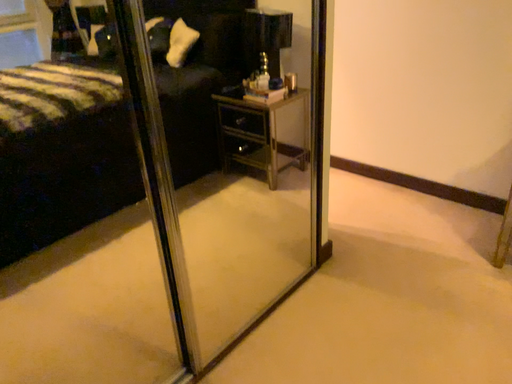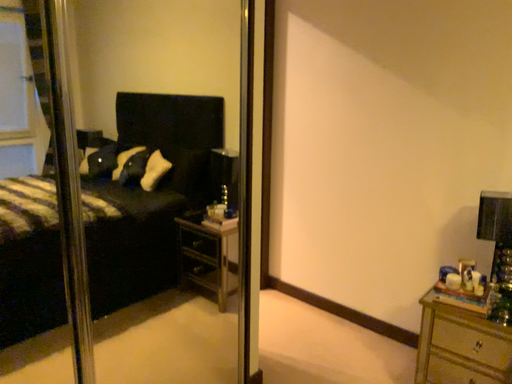
Question: How did the camera likely rotate when shooting the video?

Choices:
 (A) rotated upward
 (B) rotated downward

Answer: (A)